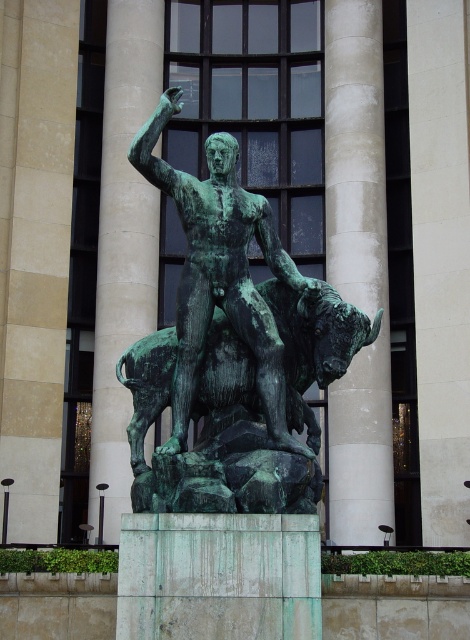
You are standing at the base of the smooth stone pillar at center. You want to place a 100 meter long banner that stretches from your current position to the building behind the statue. Is the distance sufficient?

The distance between you and the smooth stone pillar at center is 75.53 meters, which is less than the 100 meter banner. Therefore, the banner will extend beyond the available space.